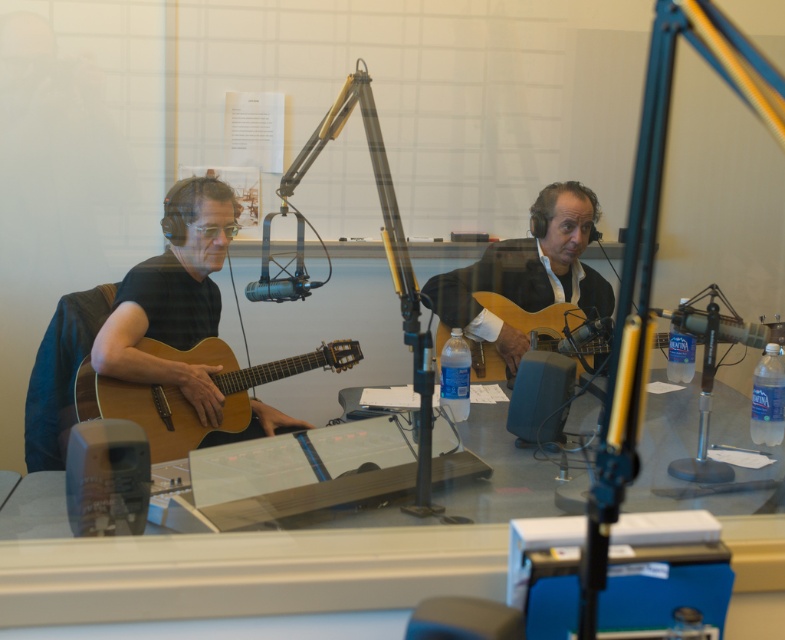
Question: Does matte black guitar at left appear over light brown acoustic guitar at center?

Choices:
 (A) yes
 (B) no

Answer: (B)

Question: Which point is farther to the camera?

Choices:
 (A) metallic silver microphone at center
 (B) clear glass table at center
 (C) matte black guitar at left

Answer: (A)

Question: Based on their relative distances, which object is farther from the matte black microphone at center?

Choices:
 (A) light brown acoustic guitar at center
 (B) metallic silver microphone at center
 (C) matte black guitar at left

Answer: (B)

Question: Is clear glass table at center smaller than light wood acoustic guitar at center?

Choices:
 (A) no
 (B) yes

Answer: (A)

Question: Is matte black guitar at left thinner than matte black microphone at center?

Choices:
 (A) no
 (B) yes

Answer: (A)

Question: Which point is farther to the camera?

Choices:
 (A) matte black guitar at left
 (B) light wood acoustic guitar at center
 (C) matte black microphone at center
 (D) natural wood acoustic guitar at left

Answer: (B)